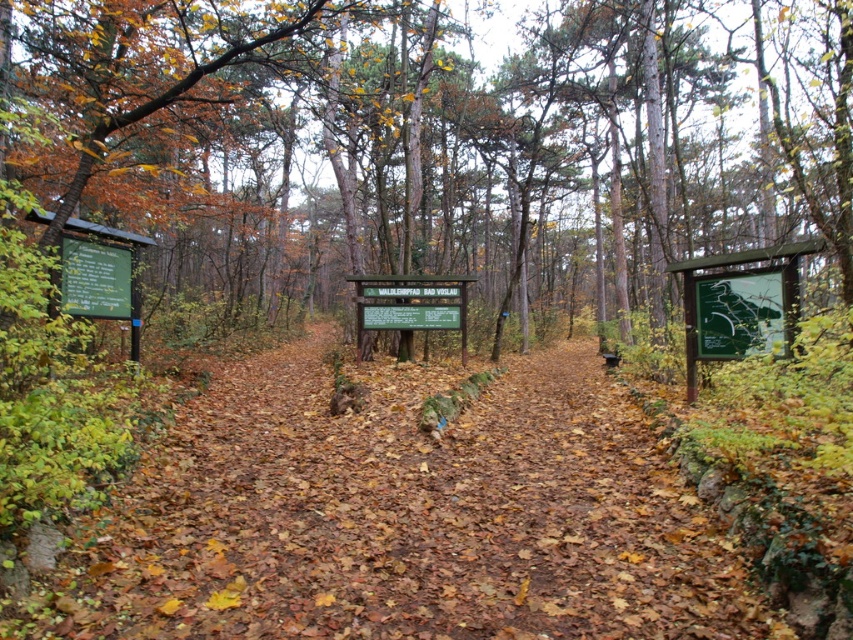
Question: Does brown wood sign at center appear under brown leafy trail at center?

Choices:
 (A) yes
 (B) no

Answer: (B)

Question: Can you confirm if green matte sign at left is thinner than green matte sign at center?

Choices:
 (A) yes
 (B) no

Answer: (A)

Question: Is green matte sign at left above green matte sign at center?

Choices:
 (A) no
 (B) yes

Answer: (B)

Question: Which point is closer to the camera taking this photo?

Choices:
 (A) (799, 124)
 (B) (112, 282)
 (C) (434, 307)
 (D) (749, 324)

Answer: (D)

Question: Which object is the farthest from the brown wood sign at center?

Choices:
 (A) green map at center
 (B) brown leafy trail at center

Answer: (A)

Question: Which point is farther to the camera?

Choices:
 (A) (338, 579)
 (B) (450, 301)

Answer: (B)